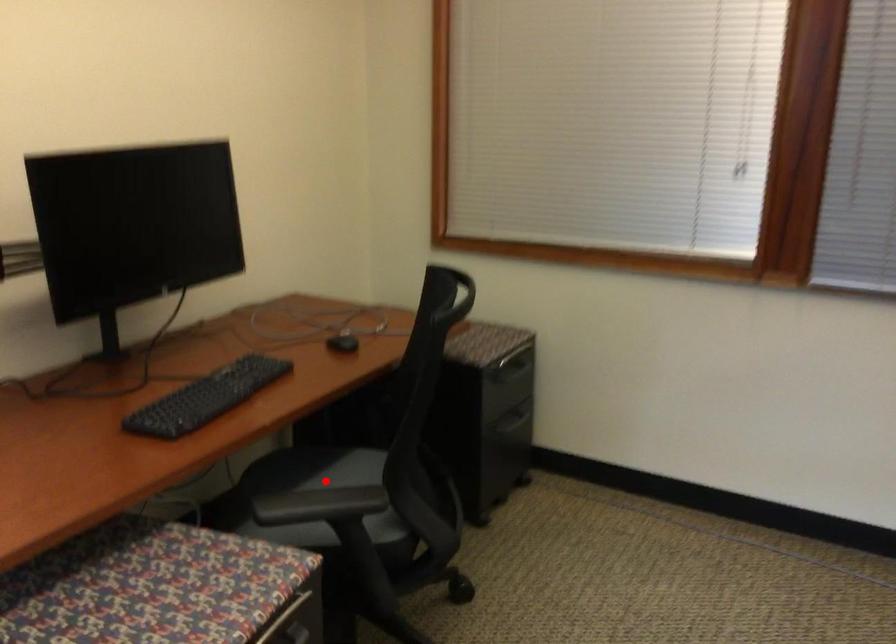
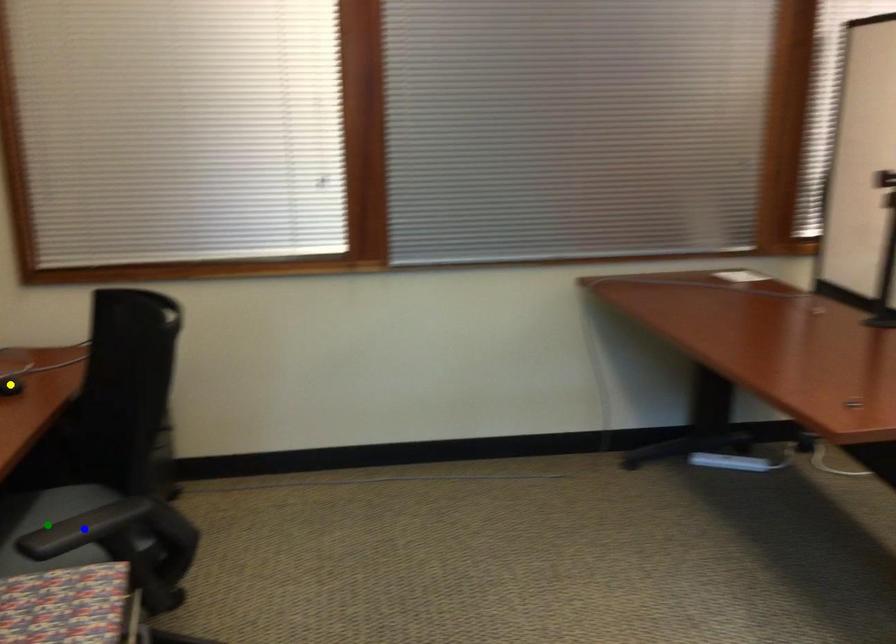
Question: I am providing you with two images of the same scene from different viewpoints. A red point is marked on the first image. You are given multiple points on the second image. Which point in image 2 is actually the same real-world point as the red point in image 1?

Choices:
 (A) yellow point
 (B) blue point
 (C) green point

Answer: (C)